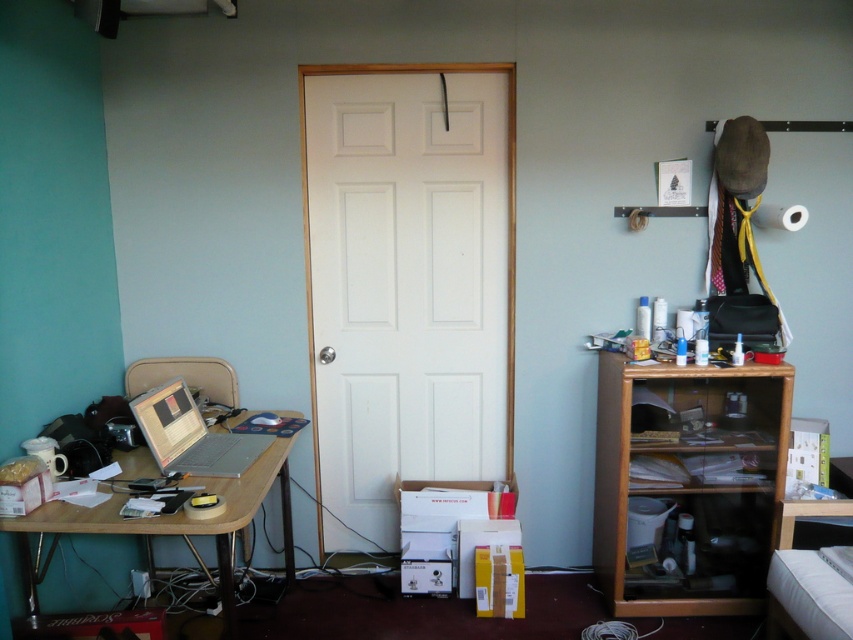
Question: Estimate the real-world distances between objects in this image. Which object is closer to the silver metallic laptop at left?

Choices:
 (A) white wooden door at center
 (B) wooden cabinet at right

Answer: (A)

Question: Which of these objects is positioned closest to the silver metallic laptop at left?

Choices:
 (A) wooden cabinet at right
 (B) white wooden door at center
 (C) wooden desk at left

Answer: (C)

Question: Which point is farther from the camera taking this photo?

Choices:
 (A) (148, 442)
 (B) (347, 72)

Answer: (B)

Question: Can you confirm if white wooden door at center is positioned to the right of wooden desk at left?

Choices:
 (A) no
 (B) yes

Answer: (B)

Question: Does white wooden door at center have a lesser width compared to wooden cabinet at right?

Choices:
 (A) no
 (B) yes

Answer: (A)

Question: Considering the relative positions of white wooden door at center and silver metallic laptop at left in the image provided, where is white wooden door at center located with respect to silver metallic laptop at left?

Choices:
 (A) right
 (B) left

Answer: (A)